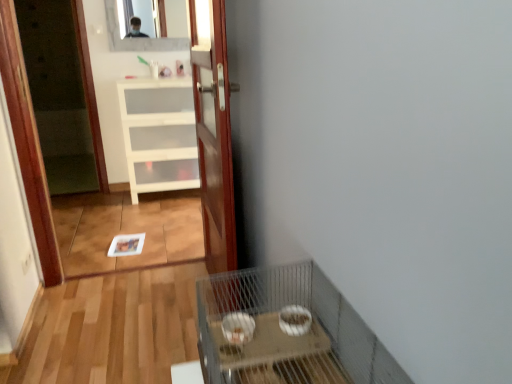
Question: Can you confirm if metal wire cage at lower right is positioned to the right of white matte cabinet at center?

Choices:
 (A) no
 (B) yes

Answer: (B)

Question: From a real-world perspective, is metal wire cage at lower right positioned over white matte cabinet at center based on gravity?

Choices:
 (A) no
 (B) yes

Answer: (B)

Question: Is metal wire cage at lower right in front of white matte cabinet at center?

Choices:
 (A) yes
 (B) no

Answer: (A)

Question: Is metal wire cage at lower right aimed at white matte cabinet at center?

Choices:
 (A) no
 (B) yes

Answer: (A)

Question: Can you confirm if metal wire cage at lower right is taller than white matte cabinet at center?

Choices:
 (A) yes
 (B) no

Answer: (B)

Question: Can you confirm if metal wire cage at lower right is smaller than white matte cabinet at center?

Choices:
 (A) yes
 (B) no

Answer: (A)

Question: From the image's perspective, is wooden door at center located above clear glass mirror at upper center?

Choices:
 (A) yes
 (B) no

Answer: (B)

Question: From a real-world perspective, is wooden door at center under clear glass mirror at upper center?

Choices:
 (A) yes
 (B) no

Answer: (A)

Question: Can you confirm if wooden door at center is positioned to the right of clear glass mirror at upper center?

Choices:
 (A) no
 (B) yes

Answer: (B)

Question: Considering the relative sizes of wooden door at center and clear glass mirror at upper center in the image provided, is wooden door at center shorter than clear glass mirror at upper center?

Choices:
 (A) yes
 (B) no

Answer: (B)

Question: Is the depth of wooden door at center less than that of clear glass mirror at upper center?

Choices:
 (A) yes
 (B) no

Answer: (A)

Question: Does wooden door at center have a lesser width compared to clear glass mirror at upper center?

Choices:
 (A) yes
 (B) no

Answer: (B)

Question: Can you confirm if metal wire cage at lower right is bigger than clear glass mirror at upper center?

Choices:
 (A) no
 (B) yes

Answer: (B)